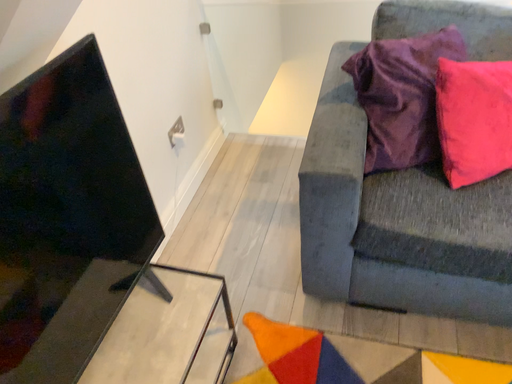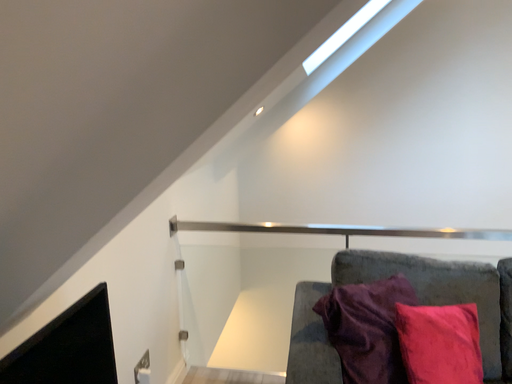
Question: How did the camera likely rotate when shooting the video?

Choices:
 (A) rotated upward
 (B) rotated downward

Answer: (A)